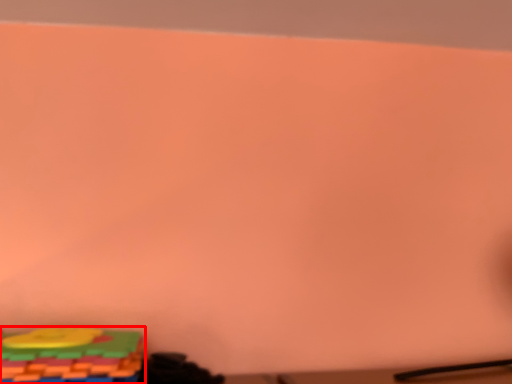
Question: Where is toy (annotated by the red box) located in relation to toy in the image?

Choices:
 (A) right
 (B) left

Answer: (B)